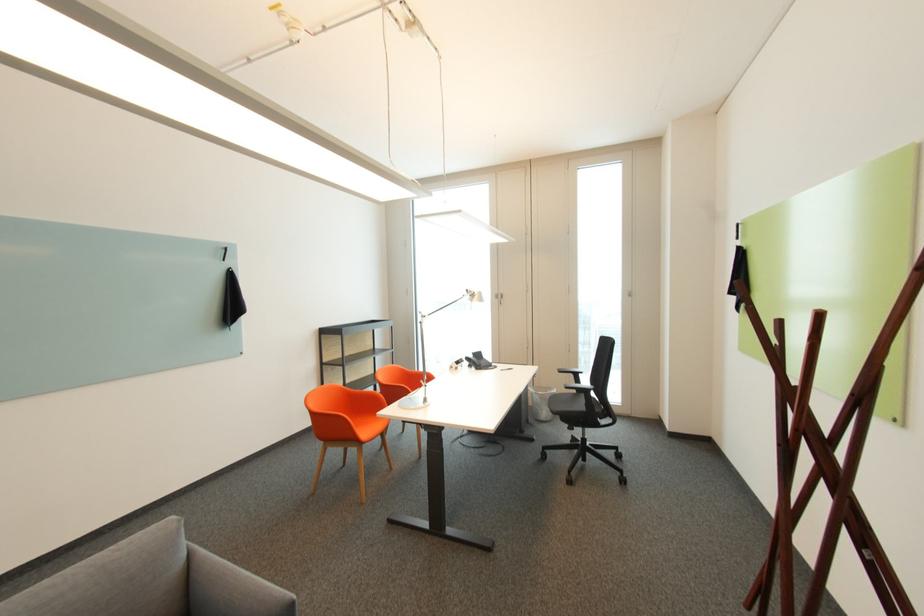
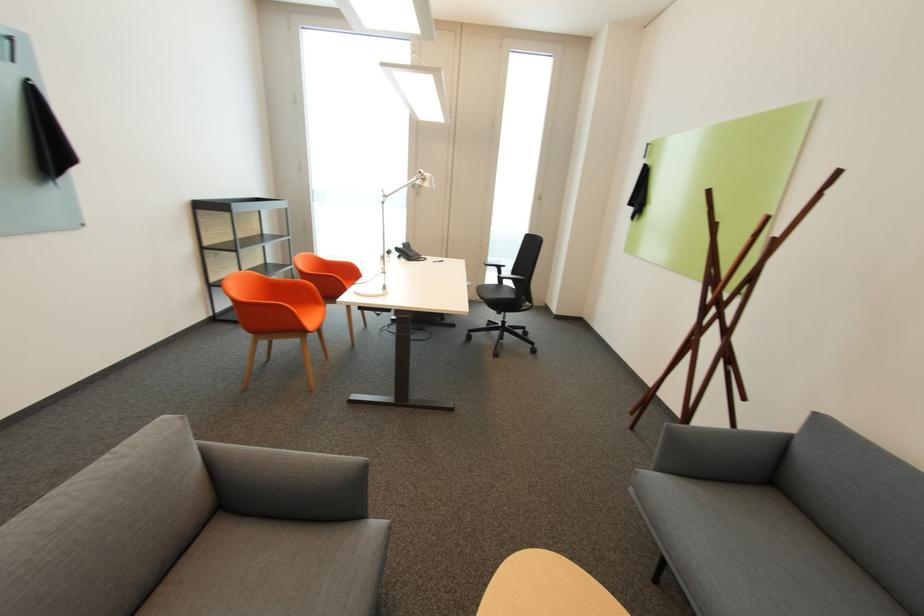
The point at (578, 376) is marked in the first image. Where is the corresponding point in the second image?

(503, 269)